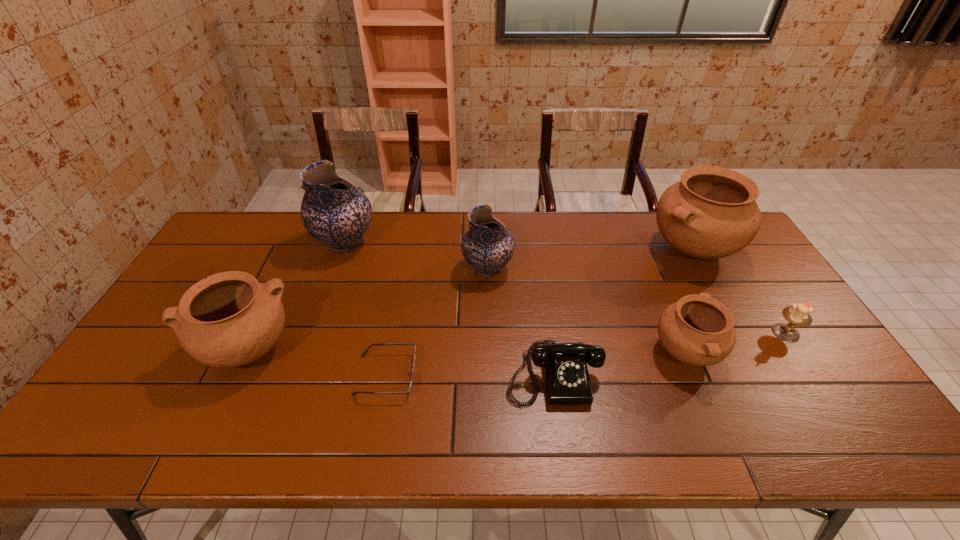
You are a GUI agent. You are given a task and a screenshot of the screen. Output one action in this format:
    pyautogui.click(x=<x>, y=<y>)
    Task: Click on the pottery situated at the right edge
    This screenshot has width=960, height=540.
    Given the screenshot: What is the action you would take?
    pyautogui.click(x=711, y=213)

Image resolution: width=960 pixels, height=540 pixels. What are the coordinates of `candle holder at the right edge` in the screenshot? It's located at (798, 314).

Identify the location of object that is at the far right corner. (711, 213).

Find the location of `vacant space at the far edge`. vacant space at the far edge is located at coordinates (283, 232).

Locate an element on the screen. The width and height of the screenshot is (960, 540). blank area at the near edge is located at coordinates (711, 424).

At what (x,y) coordinates should I click in order to perform the action: click on vacant space at the right edge of the desktop. Please return your answer as a coordinate pair (x, y). Looking at the image, I should click on [x=718, y=262].

The image size is (960, 540). Identify the location of vacant space at the near right corner. (849, 450).

The width and height of the screenshot is (960, 540). I want to click on unoccupied position between the black telephone and the spectacles, so click(x=469, y=374).

Locate an element on the screen. The width and height of the screenshot is (960, 540). empty space between the leftmost terracotta pottery and the right blue pottery is located at coordinates (367, 309).

I want to click on empty space that is in between the smaller blue pottery and the telephone, so click(520, 321).